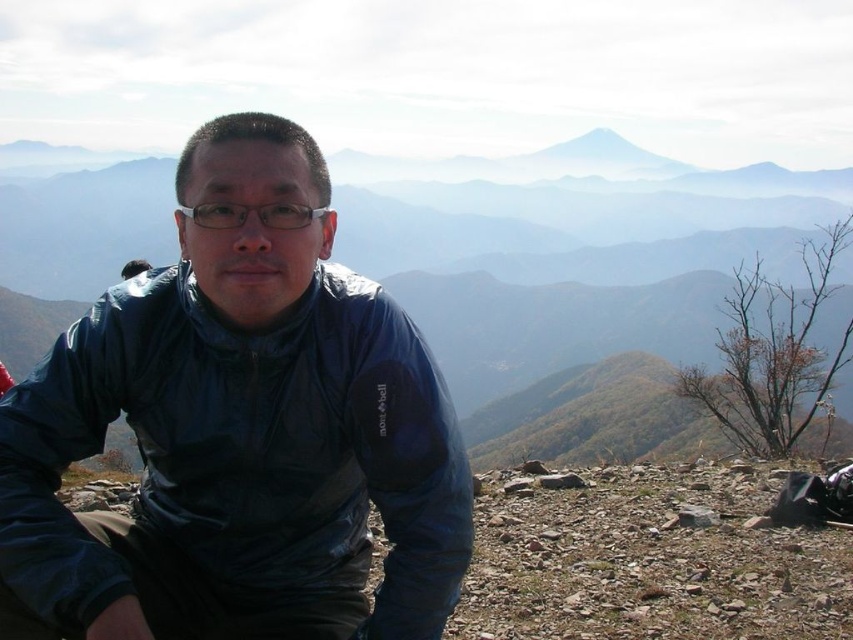
You are a photographer wanting to capture the person in the scene. Since both the matte blue jacket at center and transparent plastic glasses at center are important, which one do you need to focus on first to ensure it is in sharp focus?

The matte blue jacket at center is in front of transparent plastic glasses at center, so you should focus on the matte blue jacket at center first to ensure it is in sharp focus.